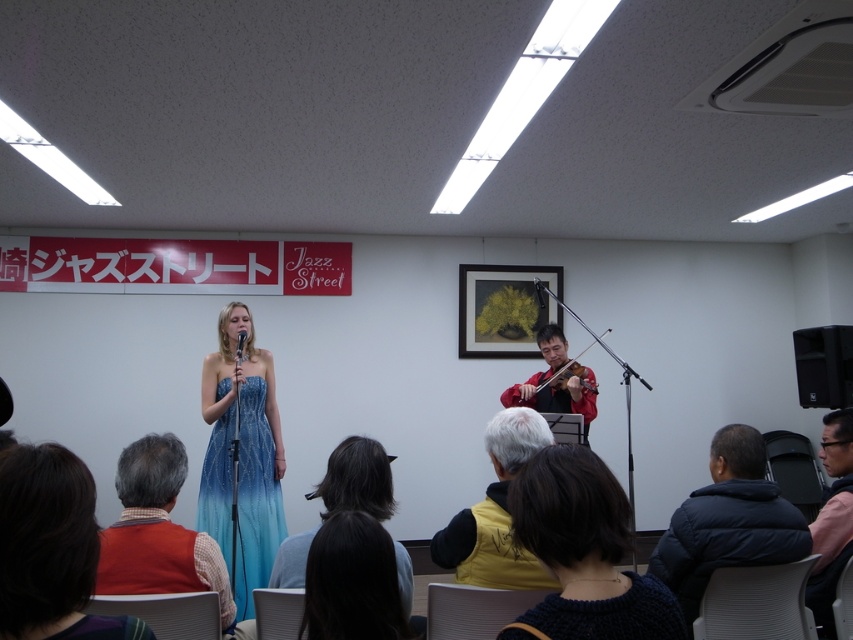
Question: Estimate the real-world distances between objects in this image. Which object is farther from the pink fabric shirt at lower right?

Choices:
 (A) blue denim dress at center
 (B) orange knit sweater at lower left
 (C) shiny red violin at center right

Answer: (B)

Question: Estimate the real-world distances between objects in this image. Which object is farther from the metallic silver microphone at upper center?

Choices:
 (A) black puffer jacket at lower right
 (B) black matte speaker at right
 (C) yellow fabric vest at lower center
 (D) pink fabric shirt at lower right

Answer: (C)

Question: Is the position of yellow fabric vest at lower center more distant than that of matte blue microphone at center?

Choices:
 (A) yes
 (B) no

Answer: (B)

Question: Which is farther from the blue denim dress at center?

Choices:
 (A) blue satin dress at center
 (B) red plaid shirt at lower left
 (C) red velvet violin at center

Answer: (C)

Question: Where is blue denim dress at center located in relation to red velvet violin at center in the image?

Choices:
 (A) below
 (B) above

Answer: (A)

Question: Is the position of black puffer jacket at lower right more distant than that of blue denim dress at center?

Choices:
 (A) no
 (B) yes

Answer: (B)